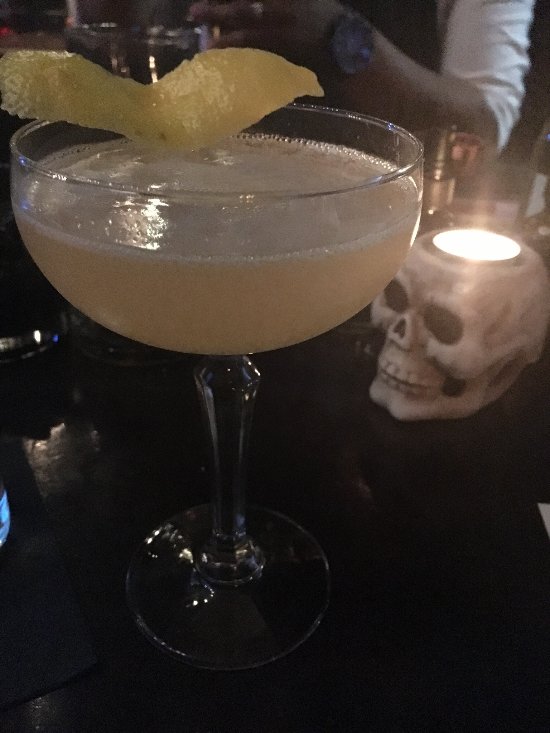
At what (x,y) coordinates should I click in order to perform the action: click on base of glass. Please return your answer as a coordinate pair (x, y). The height and width of the screenshot is (733, 550). Looking at the image, I should click on (241, 616).